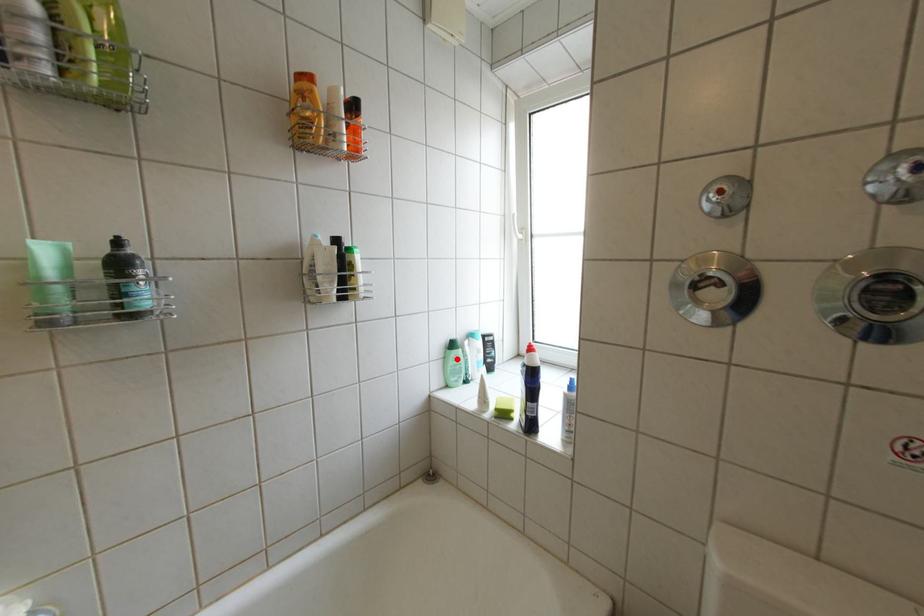
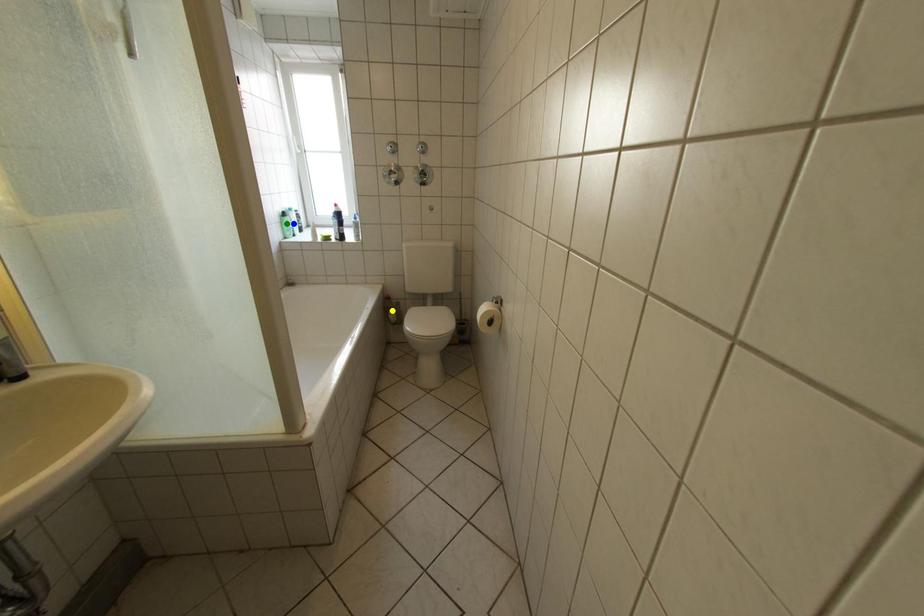
Question: I am providing you with two images of the same scene from different viewpoints. A red point is marked on the first image. You are given multiple points on the second image. Which mark in image 2 goes with the point in image 1?

Choices:
 (A) green point
 (B) blue point
 (C) yellow point

Answer: (B)